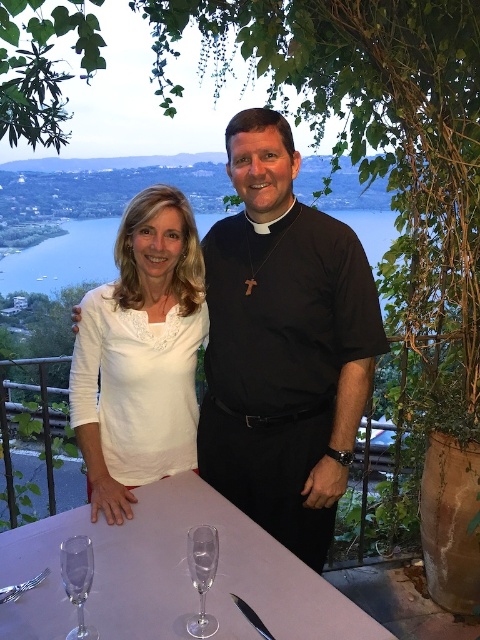
Can you confirm if black smooth shirt at center is positioned below clear glassware at center?

No, black smooth shirt at center is not below clear glassware at center.

Is point (336, 461) behind point (276, 572)?

Yes, point (336, 461) is behind point (276, 572).

Find the location of `black smooth shirt at center`. black smooth shirt at center is located at coordinates (284, 344).

Can you confirm if clear glassware at center is thinner than white lace shirt at center?

Incorrect, clear glassware at center's width is not less than white lace shirt at center's.

Can you confirm if clear glassware at center is wider than white lace shirt at center?

Indeed, clear glassware at center has a greater width compared to white lace shirt at center.

Who is more forward, (313, 577) or (106, 472)?

Point (313, 577) is in front.

Image resolution: width=480 pixels, height=640 pixels. I want to click on clear glassware at center, so click(x=171, y=576).

Between black smooth shirt at center and white lace shirt at center, which one has more height?

With more height is black smooth shirt at center.

Is point (278, 433) positioned after point (140, 362)?

Yes, point (278, 433) is farther from viewer.

Is point (208, 310) farther from viewer compared to point (133, 368)?

Yes, it is.

The image size is (480, 640). Identify the location of black smooth shirt at center. (284, 344).